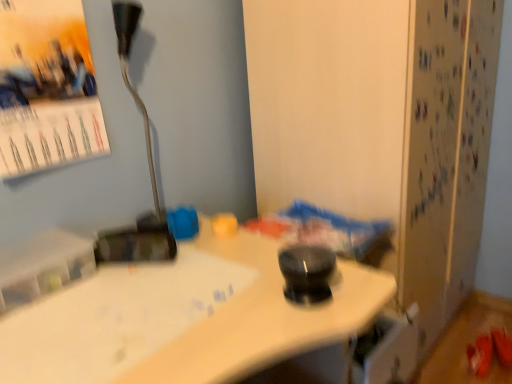
Question: From the image's perspective, is matte paper poster at upper left located above metallic silver lamp at upper left?

Choices:
 (A) yes
 (B) no

Answer: (A)

Question: Is matte paper poster at upper left facing away from metallic silver lamp at upper left?

Choices:
 (A) no
 (B) yes

Answer: (A)

Question: Is matte paper poster at upper left aimed at metallic silver lamp at upper left?

Choices:
 (A) no
 (B) yes

Answer: (A)

Question: Is matte paper poster at upper left surrounding metallic silver lamp at upper left?

Choices:
 (A) no
 (B) yes

Answer: (A)

Question: Does matte paper poster at upper left appear on the right side of metallic silver lamp at upper left?

Choices:
 (A) no
 (B) yes

Answer: (A)

Question: Is matte paper poster at upper left far away from metallic silver lamp at upper left?

Choices:
 (A) yes
 (B) no

Answer: (B)

Question: Would you say matte paper poster at upper left is part of metallic silver lamp at upper left's contents?

Choices:
 (A) yes
 (B) no

Answer: (B)

Question: Is metallic silver lamp at upper left in front of matte paper poster at upper left?

Choices:
 (A) no
 (B) yes

Answer: (A)

Question: From a real-world perspective, is metallic silver lamp at upper left located beneath matte paper poster at upper left?

Choices:
 (A) no
 (B) yes

Answer: (B)

Question: Is metallic silver lamp at upper left located outside matte paper poster at upper left?

Choices:
 (A) yes
 (B) no

Answer: (A)

Question: Is matte paper poster at upper left at the back of metallic silver lamp at upper left?

Choices:
 (A) yes
 (B) no

Answer: (B)

Question: Is metallic silver lamp at upper left further to camera compared to matte paper poster at upper left?

Choices:
 (A) no
 (B) yes

Answer: (B)

Question: From the image's perspective, is metallic silver lamp at upper left above or below matte paper poster at upper left?

Choices:
 (A) above
 (B) below

Answer: (B)